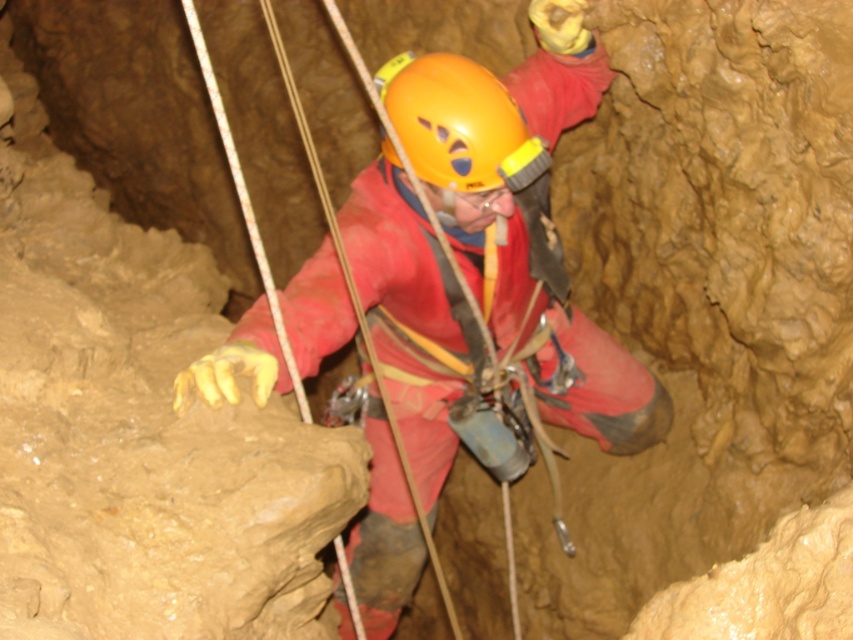
Question: Among these objects, which one is nearest to the camera?

Choices:
 (A) orange matte helmet at center
 (B) matte red jumpsuit at center

Answer: (B)

Question: Is matte red jumpsuit at center to the right of orange matte helmet at center from the viewer's perspective?

Choices:
 (A) yes
 (B) no

Answer: (A)

Question: Is matte red jumpsuit at center bigger than orange matte helmet at center?

Choices:
 (A) no
 (B) yes

Answer: (B)

Question: Can you confirm if matte red jumpsuit at center is positioned to the right of orange matte helmet at center?

Choices:
 (A) no
 (B) yes

Answer: (B)

Question: Which of the following is the farthest from the observer?

Choices:
 (A) (386, 93)
 (B) (506, 164)

Answer: (A)